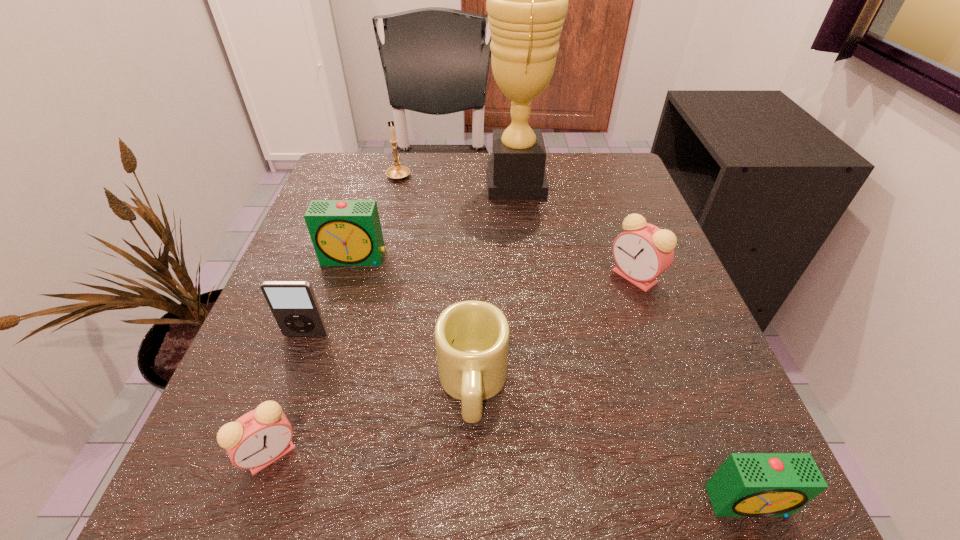
Find the location of a particular element. trophy cup is located at coordinates (527, 0).

Find the location of a particular element. yellow trophy cup is located at coordinates (527, 0).

The image size is (960, 540). Identify the location of gold candle holder. (397, 172).

Where is `the right pink alarm clock`? the right pink alarm clock is located at coordinates (643, 251).

What are the coordinates of `the bigger pink alarm clock` in the screenshot? It's located at 643,251.

At what (x,y) coordinates should I click in order to perform the action: click on the farther green alarm clock. Please return your answer as a coordinate pair (x, y). Looking at the image, I should click on 344,232.

Locate an element on the screen. The width and height of the screenshot is (960, 540). the bigger green alarm clock is located at coordinates (344, 232).

You are a GUI agent. You are given a task and a screenshot of the screen. Output one action in this format:
    pyautogui.click(x=<x>, y=<y>)
    Task: Click on the fifth farthest object
    This screenshot has width=960, height=540.
    Given the screenshot: What is the action you would take?
    pyautogui.click(x=293, y=304)

Where is `beige mug`? The width and height of the screenshot is (960, 540). beige mug is located at coordinates (472, 337).

The image size is (960, 540). I want to click on the nearer pink alarm clock, so [x=258, y=438].